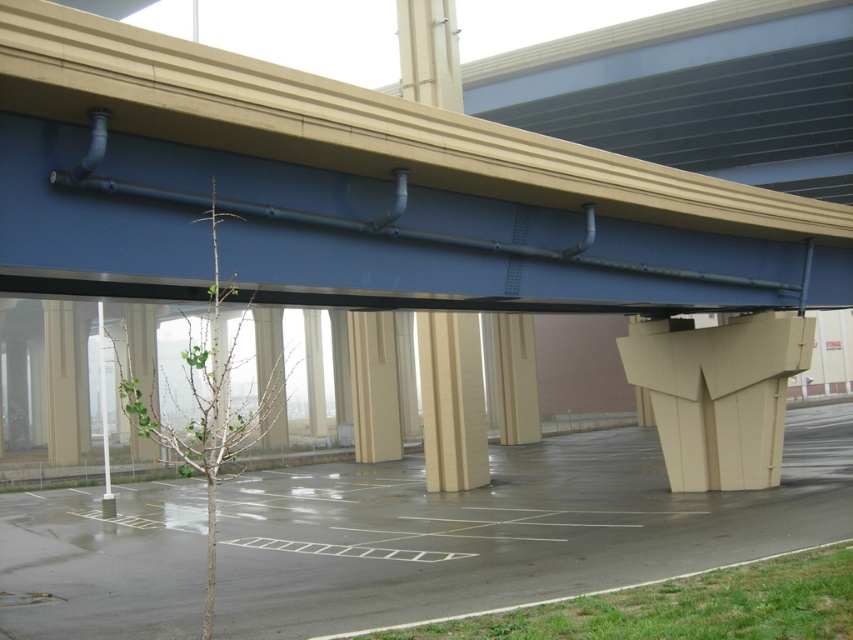
Question: Which object is closer to the camera taking this photo?

Choices:
 (A) beige concrete pillar at center
 (B) beige textured column at center

Answer: (B)

Question: Can you confirm if smooth asphalt parking lot at center is positioned to the left of beige concrete pillar at center?

Choices:
 (A) yes
 (B) no

Answer: (A)

Question: Which of the following is the closest to the observer?

Choices:
 (A) (44, 154)
 (B) (500, 320)
 (C) (354, 605)
 (D) (426, 356)

Answer: (A)

Question: Can you confirm if smooth concrete overpass at center is smaller than beige textured column at center?

Choices:
 (A) yes
 (B) no

Answer: (B)

Question: Which point appears closest to the camera in this image?

Choices:
 (A) (447, 362)
 (B) (316, 97)
 (C) (419, 532)
 (D) (500, 337)

Answer: (B)

Question: Is smooth concrete overpass at center to the right of beige concrete pillar at center from the viewer's perspective?

Choices:
 (A) no
 (B) yes

Answer: (A)